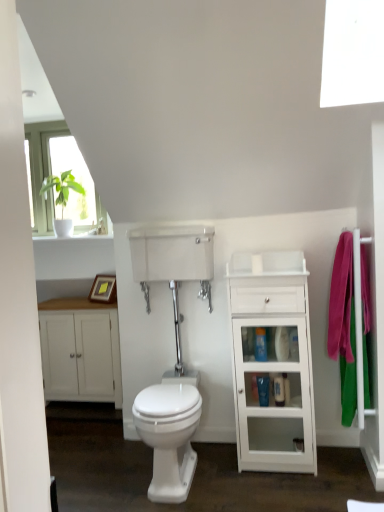
Image resolution: width=384 pixels, height=512 pixels. In order to click on vacant area that lies to the right of white glossy bidet at center in this screenshot , I will do `click(243, 482)`.